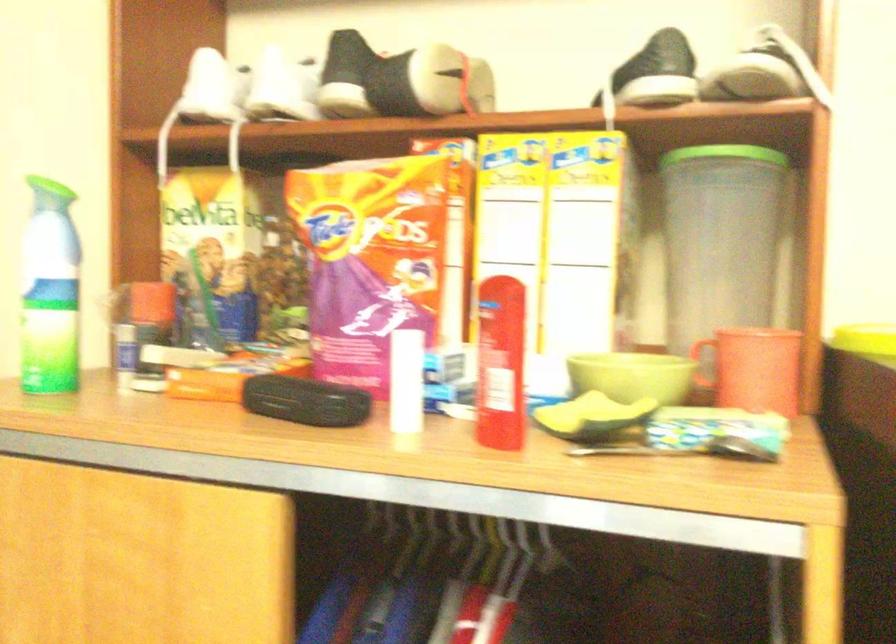
Find where to push the green spray bottle nozzle. Please return your answer as a coordinate pair (x, y).

(49, 292)